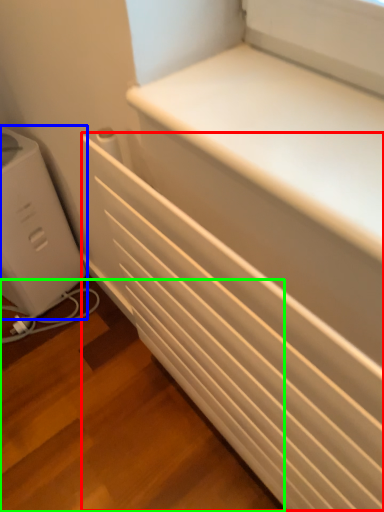
Question: Which object is positioned farthest from radiator (highlighted by a red box)? Select from home appliance (highlighted by a blue box) and stairwell (highlighted by a green box).

Choices:
 (A) home appliance
 (B) stairwell

Answer: (A)